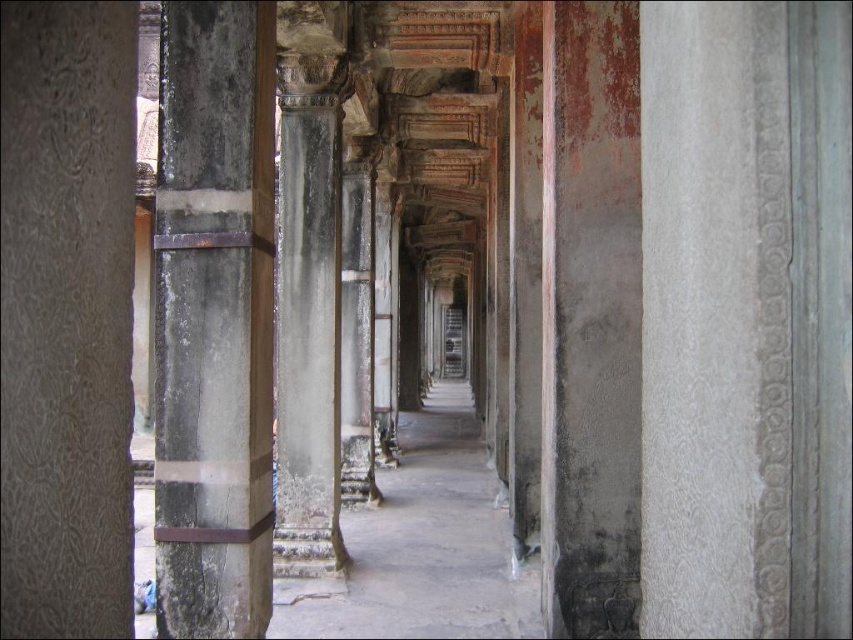
In the scene shown: Does gray textured stone pillar at left appear over dark gray stone pillar at left?

Yes.

The image size is (853, 640). What do you see at coordinates (67, 316) in the screenshot? I see `gray textured stone pillar at left` at bounding box center [67, 316].

Is point (10, 316) in front of point (200, 136)?

Yes, point (10, 316) is closer to viewer.

Locate an element on the screen. Image resolution: width=853 pixels, height=640 pixels. gray textured stone pillar at left is located at coordinates click(67, 316).